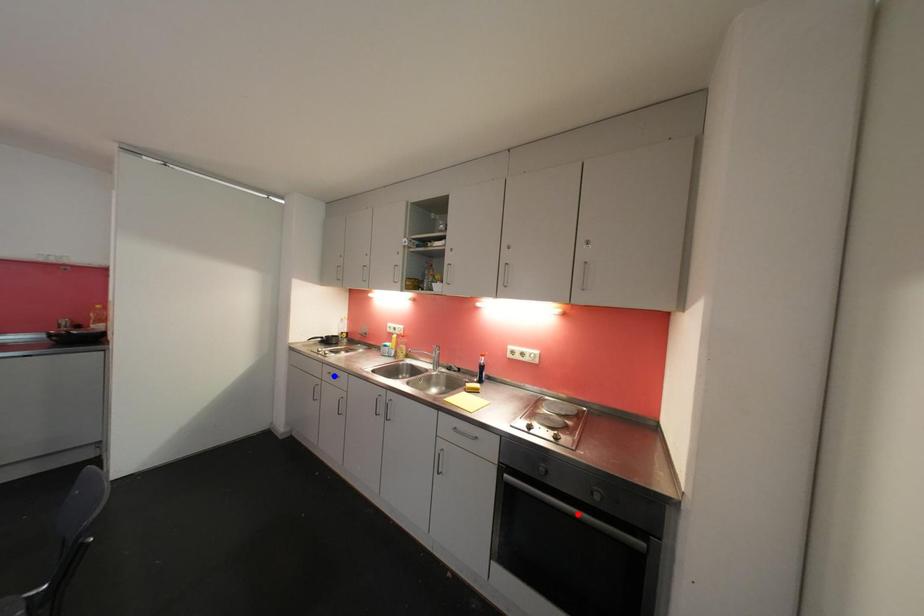
Question: Two points are marked on the image. Which point is closer to the camera?

Choices:
 (A) Blue point is closer.
 (B) Red point is closer.

Answer: (B)